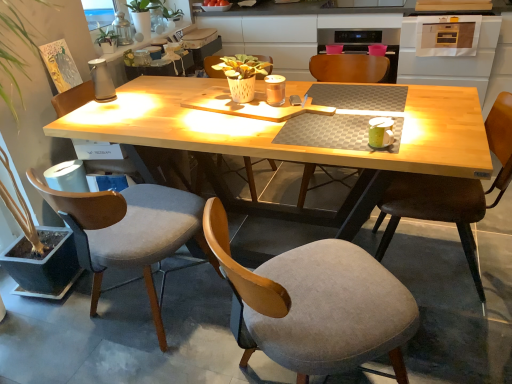
Locate an element on the screen. The height and width of the screenshot is (384, 512). gray fabric chair at lower center, the third chair when ordered from right to left is located at coordinates coord(315,305).

What do you see at coordinates (129, 231) in the screenshot? I see `velvet grey chair at left, which appears as the 5th chair when viewed from the right` at bounding box center [129, 231].

Describe the element at coordinates (106, 40) in the screenshot. Image resolution: width=512 pixels, height=384 pixels. I see `green matte plant at upper left, marked as the second houseplant in a top-to-bottom arrangement` at that location.

Describe the element at coordinates (161, 166) in the screenshot. I see `gray fabric chair at left, the 6th chair from the right` at that location.

Based on the photo, in order to face green leafy plant at upper left, marked as the first houseplant in a top-to-bottom arrangement, should I rotate leftwards or rightwards?

To align with it, rotate left about 14.207°.

Image resolution: width=512 pixels, height=384 pixels. What are the coordinates of `wooden chair at center, marked as the 4th chair in a right-to-left arrangement` in the screenshot? It's located at (213, 65).

Does gray fabric chair at lower center, the third chair when ordered from right to left, touch matte wooden chair at center, the 2th chair from the right?

gray fabric chair at lower center, the third chair when ordered from right to left, is not next to matte wooden chair at center, the 2th chair from the right, and they're not touching.

Looking at the image, does gray fabric chair at lower center, the third chair when ordered from right to left, seem bigger or smaller compared to matte wooden chair at center, which is the 5th chair from left to right?

Clearly, gray fabric chair at lower center, the third chair when ordered from right to left, is smaller in size than matte wooden chair at center, which is the 5th chair from left to right.

Considering the relative sizes of gray fabric chair at lower center, the 4th chair in the left-to-right sequence, and matte wooden chair at center, the 2th chair from the right, in the image provided, is gray fabric chair at lower center, the 4th chair in the left-to-right sequence, taller than matte wooden chair at center, the 2th chair from the right,?

In fact, gray fabric chair at lower center, the 4th chair in the left-to-right sequence, may be shorter than matte wooden chair at center, the 2th chair from the right.

Locate an element on the screen. chair that is the 4th one when counting backward from the gray fabric chair at lower center, the third chair when ordered from right to left is located at coordinates (349, 68).

Considering the relative sizes of green matte coffee cup at upper right and green leafy plant at upper left, marked as the first houseplant in a top-to-bottom arrangement, in the image provided, is green matte coffee cup at upper right shorter than green leafy plant at upper left, marked as the first houseplant in a top-to-bottom arrangement,?

Yes, green matte coffee cup at upper right is shorter than green leafy plant at upper left, marked as the first houseplant in a top-to-bottom arrangement.

Which of these two, green matte coffee cup at upper right or green leafy plant at upper left, marked as the first houseplant in a top-to-bottom arrangement, is smaller?

With smaller size is green matte coffee cup at upper right.

From a real-world perspective, between velvet grey chair at left, which is the 2th chair in left-to-right order, and matte wooden chair at center, which is the 5th chair from left to right, who is vertically lower?

velvet grey chair at left, which is the 2th chair in left-to-right order.

Could you tell me if velvet grey chair at left, which is the 2th chair in left-to-right order, is turned towards matte wooden chair at center, which is the 5th chair from left to right?

Yes.

Would you say matte wooden chair at center, which is the 5th chair from left to right, is part of velvet grey chair at left, which is the 2th chair in left-to-right order,'s contents?

Actually, matte wooden chair at center, which is the 5th chair from left to right, is outside velvet grey chair at left, which is the 2th chair in left-to-right order.

Which of these two, velvet grey chair at left, which appears as the 5th chair when viewed from the right, or matte wooden chair at center, the 2th chair from the right, is smaller?

Smaller between the two is matte wooden chair at center, the 2th chair from the right.

Is gray fabric chair at lower center, the third chair when ordered from right to left, inside or outside of velvet grey chair at left, which appears as the 5th chair when viewed from the right?

gray fabric chair at lower center, the third chair when ordered from right to left, is located beyond the bounds of velvet grey chair at left, which appears as the 5th chair when viewed from the right.

Consider the image. From their relative heights in the image, would you say gray fabric chair at lower center, the third chair when ordered from right to left, is taller or shorter than velvet grey chair at left, which appears as the 5th chair when viewed from the right?

gray fabric chair at lower center, the third chair when ordered from right to left, is taller than velvet grey chair at left, which appears as the 5th chair when viewed from the right.

How different are the orientations of gray fabric chair at lower center, the 4th chair in the left-to-right sequence, and velvet grey chair at left, which appears as the 5th chair when viewed from the right, in degrees?

The facing directions of gray fabric chair at lower center, the 4th chair in the left-to-right sequence, and velvet grey chair at left, which appears as the 5th chair when viewed from the right, are 35.5 degrees apart.

Is gray fabric chair at lower center, the 4th chair in the left-to-right sequence, looking in the opposite direction of velvet grey chair at left, which is the 2th chair in left-to-right order?

No, gray fabric chair at lower center, the 4th chair in the left-to-right sequence,'s orientation is not away from velvet grey chair at left, which is the 2th chair in left-to-right order.

Is the surface of green leafy plant at upper left, marked as the first houseplant in a top-to-bottom arrangement, in direct contact with gray fabric chair at lower center, the 4th chair in the left-to-right sequence?

No, green leafy plant at upper left, marked as the first houseplant in a top-to-bottom arrangement, is not with gray fabric chair at lower center, the 4th chair in the left-to-right sequence.

From a real-world perspective, is green leafy plant at upper left, which is counted as the 2th houseplant, starting from the bottom, physically below gray fabric chair at lower center, the third chair when ordered from right to left?

No, from a real-world perspective, green leafy plant at upper left, which is counted as the 2th houseplant, starting from the bottom, is not below gray fabric chair at lower center, the third chair when ordered from right to left.

Between green leafy plant at upper left, which is counted as the 2th houseplant, starting from the bottom, and gray fabric chair at lower center, the third chair when ordered from right to left, which one has smaller size?

With smaller size is green leafy plant at upper left, which is counted as the 2th houseplant, starting from the bottom.

How much distance is there between green leafy plant at upper left, marked as the first houseplant in a top-to-bottom arrangement, and gray fabric chair at lower center, the third chair when ordered from right to left?

They are 7.76 feet apart.

From the image's perspective, is green matte coffee cup at upper right below green matte plant at upper left, acting as the 1th houseplant starting from the bottom?

Result: Yes.

Is green matte coffee cup at upper right positioned before green matte plant at upper left, acting as the 1th houseplant starting from the bottom?

Yes, it is in front of green matte plant at upper left, acting as the 1th houseplant starting from the bottom.

Considering the sizes of objects green matte coffee cup at upper right and green matte plant at upper left, acting as the 1th houseplant starting from the bottom, in the image provided, who is shorter, green matte coffee cup at upper right or green matte plant at upper left, acting as the 1th houseplant starting from the bottom,?

With less height is green matte coffee cup at upper right.

From a real-world perspective, between green matte plant at upper left, marked as the second houseplant in a top-to-bottom arrangement, and gray fabric chair at left, the 6th chair from the right, who is vertically lower?

In real-world perspective, gray fabric chair at left, the 6th chair from the right, is lower.

In the scene shown: Is green matte plant at upper left, marked as the second houseplant in a top-to-bottom arrangement, looking in the opposite direction of gray fabric chair at left, which is the 1th chair in left-to-right order?

No, green matte plant at upper left, marked as the second houseplant in a top-to-bottom arrangement,'s orientation is not away from gray fabric chair at left, which is the 1th chair in left-to-right order.

Is green matte plant at upper left, marked as the second houseplant in a top-to-bottom arrangement, spatially inside gray fabric chair at left, which is the 1th chair in left-to-right order, or outside of it?

green matte plant at upper left, marked as the second houseplant in a top-to-bottom arrangement, is outside gray fabric chair at left, which is the 1th chair in left-to-right order.

Is green matte plant at upper left, acting as the 1th houseplant starting from the bottom, positioned in front of gray fabric chair at left, the 6th chair from the right?

No.

I want to click on the 1st chair positioned below the matte wooden chair at center, which is the 5th chair from left to right (from a real-world perspective), so click(315, 305).

Locate an element on the screen. This screenshot has height=384, width=512. coffee cup that appears below the green leafy plant at upper left, marked as the first houseplant in a top-to-bottom arrangement (from the image's perspective) is located at coordinates (381, 132).

Which object lies nearer to the anchor point green leafy plant at upper left, marked as the first houseplant in a top-to-bottom arrangement, green matte plant at upper left, marked as the second houseplant in a top-to-bottom arrangement, or matte wooden chair at center, the 2th chair from the right?

green matte plant at upper left, marked as the second houseplant in a top-to-bottom arrangement.

Which object lies nearer to the anchor point gray fabric chair at left, which is the 1th chair in left-to-right order, brown leather chair at right, acting as the first chair starting from the right, or velvet grey chair at left, which appears as the 5th chair when viewed from the right?

velvet grey chair at left, which appears as the 5th chair when viewed from the right, is positioned closer to the anchor gray fabric chair at left, which is the 1th chair in left-to-right order.

Based on their spatial positions, is velvet grey chair at left, which is the 2th chair in left-to-right order, or green matte plant at upper left, acting as the 1th houseplant starting from the bottom, further from matte wooden chair at center, which is the 5th chair from left to right?

Based on the image, green matte plant at upper left, acting as the 1th houseplant starting from the bottom, appears to be further to matte wooden chair at center, which is the 5th chair from left to right.

From the picture: Based on their spatial positions, is green matte coffee cup at upper right or matte wooden chair at center, which is the 5th chair from left to right, further from brown leather chair at right, the 6th chair positioned from the left?

matte wooden chair at center, which is the 5th chair from left to right, lies further to brown leather chair at right, the 6th chair positioned from the left, than the other object.

From the image, which object appears to be nearer to green matte coffee cup at upper right, green leafy plant at upper left, which is counted as the 2th houseplant, starting from the bottom, or green matte plant at upper left, acting as the 1th houseplant starting from the bottom?

Among the two, green matte plant at upper left, acting as the 1th houseplant starting from the bottom, is located nearer to green matte coffee cup at upper right.

Which object lies further to the anchor point velvet grey chair at left, which is the 2th chair in left-to-right order, matte wooden chair at center, the 2th chair from the right, or green matte plant at upper left, acting as the 1th houseplant starting from the bottom?

green matte plant at upper left, acting as the 1th houseplant starting from the bottom, is further to velvet grey chair at left, which is the 2th chair in left-to-right order.

When comparing their distances from green matte plant at upper left, marked as the second houseplant in a top-to-bottom arrangement, does gray fabric chair at lower center, the 4th chair in the left-to-right sequence, or matte wooden chair at center, which is the 5th chair from left to right, seem closer?

matte wooden chair at center, which is the 5th chair from left to right, lies closer to green matte plant at upper left, marked as the second houseplant in a top-to-bottom arrangement, than the other object.

Looking at the image, which one is located closer to wooden chair at center, marked as the 4th chair in a right-to-left arrangement, green matte coffee cup at upper right or velvet grey chair at left, which is the 2th chair in left-to-right order?

Based on the image, velvet grey chair at left, which is the 2th chair in left-to-right order, appears to be nearer to wooden chair at center, marked as the 4th chair in a right-to-left arrangement.

Identify the location of houseplant between green matte plant at upper left, marked as the second houseplant in a top-to-bottom arrangement, and green matte coffee cup at upper right from left to right. The height and width of the screenshot is (384, 512). (143, 15).

The width and height of the screenshot is (512, 384). What are the coordinates of `houseplant between green matte plant at upper left, acting as the 1th houseplant starting from the bottom, and matte wooden chair at center, which is the 5th chair from left to right` in the screenshot? It's located at (143, 15).

This screenshot has width=512, height=384. I want to click on coffee cup located between wooden chair at center, marked as the 4th chair in a right-to-left arrangement, and brown leather chair at right, acting as the first chair starting from the right, in the left-right direction, so click(x=381, y=132).

Where is `houseplant between gray fabric chair at lower center, the third chair when ordered from right to left, and green leafy plant at upper left, which is counted as the 2th houseplant, starting from the bottom, along the z-axis`? houseplant between gray fabric chair at lower center, the third chair when ordered from right to left, and green leafy plant at upper left, which is counted as the 2th houseplant, starting from the bottom, along the z-axis is located at coordinates (106, 40).